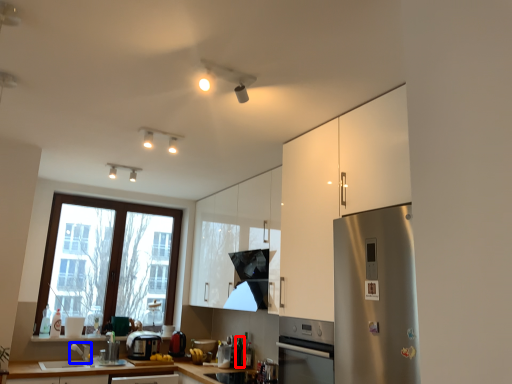
Question: Which of the following is the closest to the observer, bottle (highlighted by a red box) or faucet (highlighted by a blue box)?

Choices:
 (A) bottle
 (B) faucet

Answer: (B)